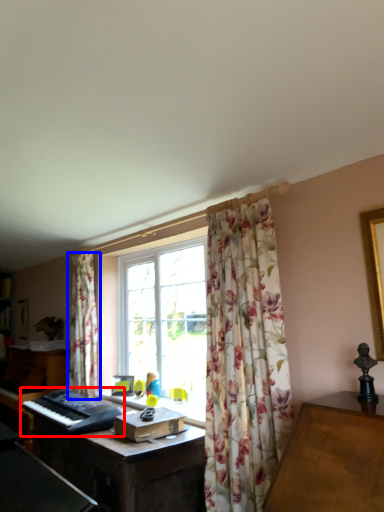
Question: Which object is further to the camera taking this photo, musical keyboard (highlighted by a red box) or curtain (highlighted by a blue box)?

Choices:
 (A) musical keyboard
 (B) curtain

Answer: (B)